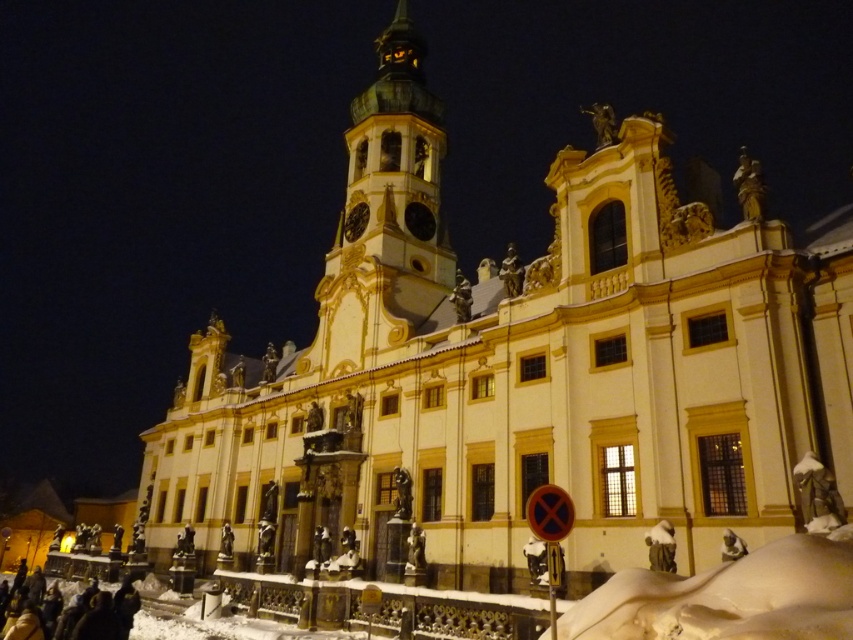
Who is lower down, white fluffy snow at lower right or dark brown leather coat at lower left?

dark brown leather coat at lower left is lower down.

Is point (624, 580) behind point (57, 620)?

No, (624, 580) is closer to viewer.

You are a GUI agent. You are given a task and a screenshot of the screen. Output one action in this format:
    pyautogui.click(x=<x>, y=<y>)
    Task: Click on the white fluffy snow at lower right
    The width and height of the screenshot is (853, 640).
    Given the screenshot: What is the action you would take?
    pyautogui.click(x=728, y=596)